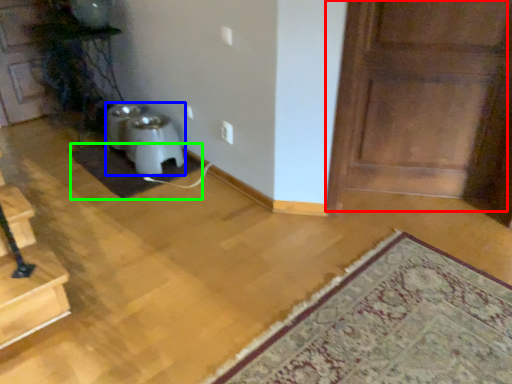
Question: Estimate the real-world distances between objects in this image. Which object is closer to door (highlighted by a red box), wide (highlighted by a blue box) or doormat (highlighted by a green box)?

Choices:
 (A) wide
 (B) doormat

Answer: (B)